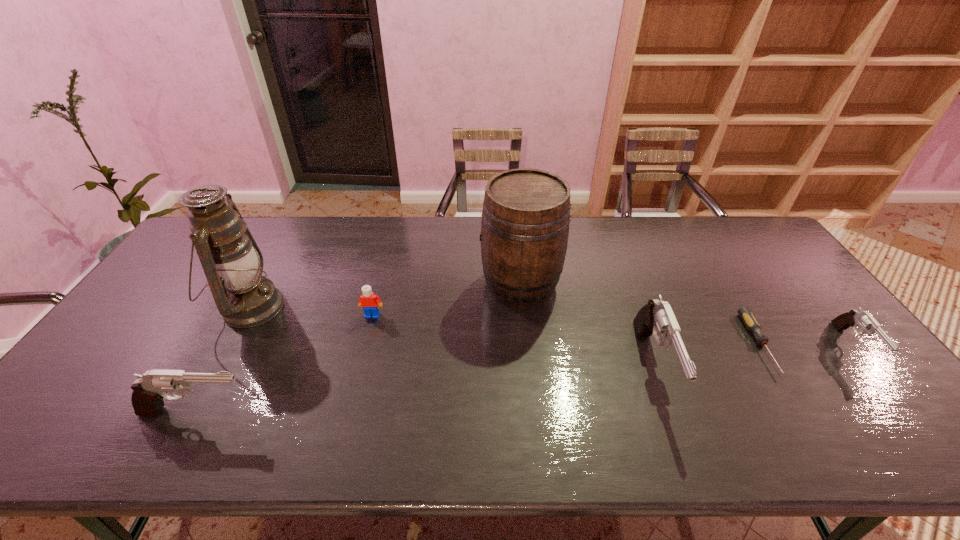
If equal spacing is the goal by inserting an additional gun among them, please point out a vacant space for this new gun. Please provide its 2D coordinates. Your answer should be formatted as a tuple, i.e. [(x, y)], where the tuple contains the x and y coordinates of a point satisfying the conditions above.

[(436, 388)]